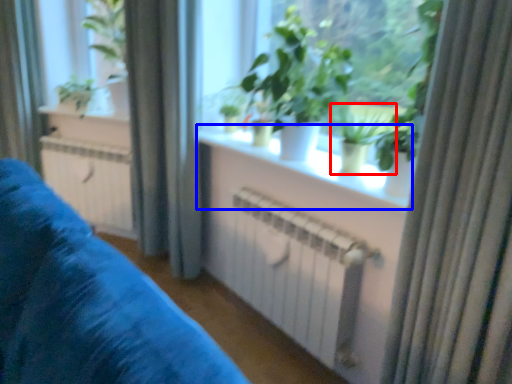
Question: Which of the following is the closest to the observer, houseplant (highlighted by a red box) or window sill (highlighted by a blue box)?

Choices:
 (A) houseplant
 (B) window sill

Answer: (B)